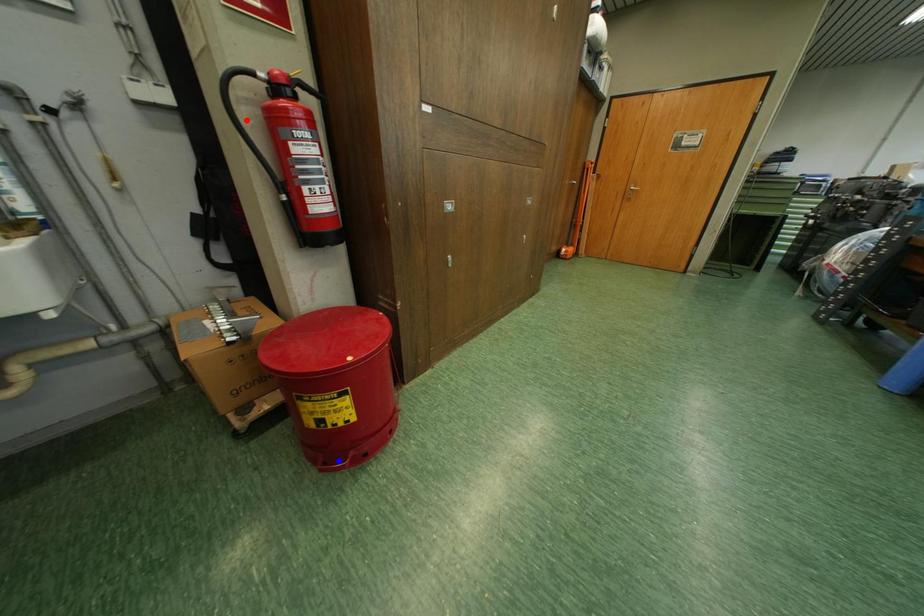
Question: In the image, two points are highlighted. Which point is nearer to the camera? Reply with the corresponding letter.

Choices:
 (A) blue point
 (B) red point

Answer: (B)